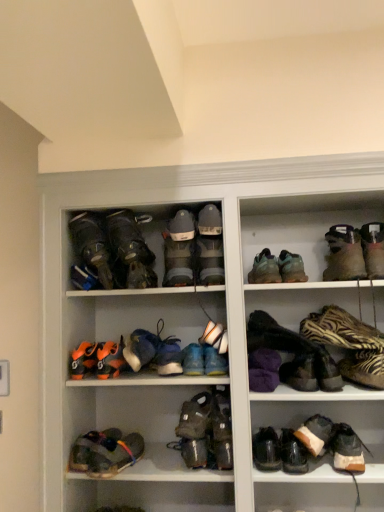
Question: Does brown suede shoe at lower right, which is counted as the first footwear, starting from the right, have a smaller size compared to matte gray boots at center, the 7th footwear when ordered from left to right?

Choices:
 (A) no
 (B) yes

Answer: (B)

Question: From the image's perspective, is brown suede shoe at lower right, which is counted as the first footwear, starting from the right, above matte gray boots at center, marked as the fourteenth footwear in a right-to-left arrangement?

Choices:
 (A) no
 (B) yes

Answer: (A)

Question: Is brown suede shoe at lower right, arranged as the 20th footwear when viewed from the left, turned away from matte gray boots at center, the 7th footwear when ordered from left to right?

Choices:
 (A) yes
 (B) no

Answer: (B)

Question: From a real-world perspective, is brown suede shoe at lower right, which is counted as the first footwear, starting from the right, beneath matte gray boots at center, the 7th footwear when ordered from left to right?

Choices:
 (A) no
 (B) yes

Answer: (B)

Question: Is brown suede shoe at lower right, which is counted as the first footwear, starting from the right, oriented towards matte gray boots at center, the 7th footwear when ordered from left to right?

Choices:
 (A) yes
 (B) no

Answer: (B)

Question: Considering the relative sizes of white fabric shoe at center, the tenth footwear positioned from the right, and leather hiking boots at upper left, the 3th footwear positioned from the left, in the image provided, is white fabric shoe at center, the tenth footwear positioned from the right, bigger than leather hiking boots at upper left, the 3th footwear positioned from the left,?

Choices:
 (A) no
 (B) yes

Answer: (A)

Question: From the image's perspective, would you say white fabric shoe at center, the tenth footwear positioned from the right, is positioned over leather hiking boots at upper left, the 3th footwear positioned from the left?

Choices:
 (A) no
 (B) yes

Answer: (A)

Question: Does white fabric shoe at center, the tenth footwear positioned from the right, appear on the left side of leather hiking boots at upper left, the 3th footwear positioned from the left?

Choices:
 (A) no
 (B) yes

Answer: (A)

Question: Is white fabric shoe at center, the eleventh footwear when ordered from left to right, positioned beyond the bounds of leather hiking boots at upper left, the 3th footwear positioned from the left?

Choices:
 (A) yes
 (B) no

Answer: (A)

Question: Would you say leather hiking boots at upper left, the 3th footwear positioned from the left, is part of white fabric shoe at center, the tenth footwear positioned from the right,'s contents?

Choices:
 (A) yes
 (B) no

Answer: (B)

Question: Can you confirm if white fabric shoe at center, the tenth footwear positioned from the right, is shorter than leather hiking boots at upper left, which is counted as the 18th footwear, starting from the right?

Choices:
 (A) yes
 (B) no

Answer: (A)

Question: Could you tell me if leather hiking boots at upper left, which is counted as the 18th footwear, starting from the right, is turned towards purple fuzzy slippers at center, marked as the seventh footwear in a right-to-left arrangement?

Choices:
 (A) no
 (B) yes

Answer: (A)